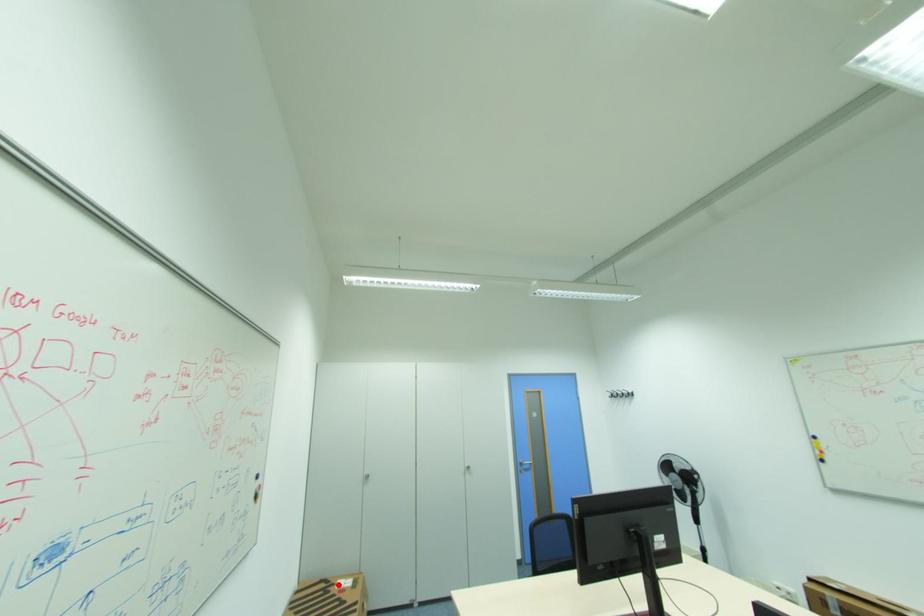
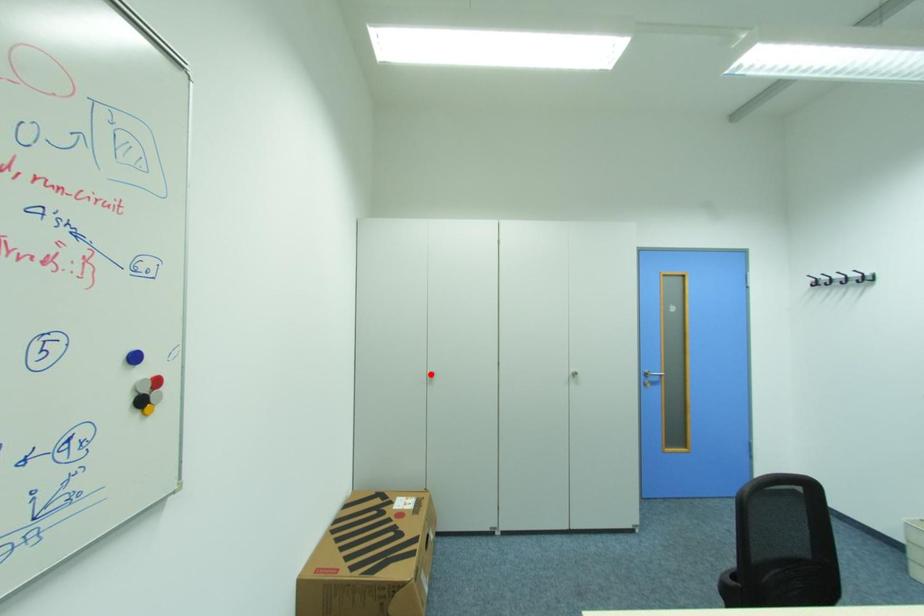
I am providing you with two images of the same scene from different viewpoints. A red point is marked on the first image and another point is marked on the second image. Is the marked point in image1 the same physical position as the marked point in image2?

No